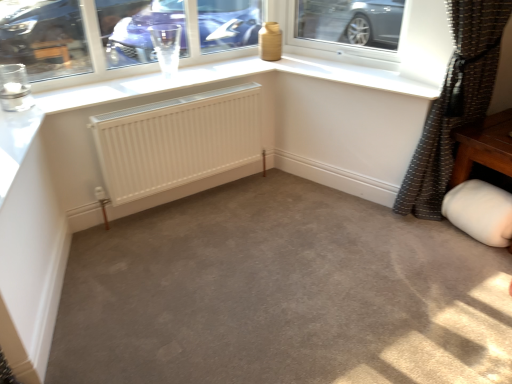
The image size is (512, 384). Find the location of `vacant area that lies between brown textured curtain at right and white matte jar at lower right`. vacant area that lies between brown textured curtain at right and white matte jar at lower right is located at coordinates (445, 245).